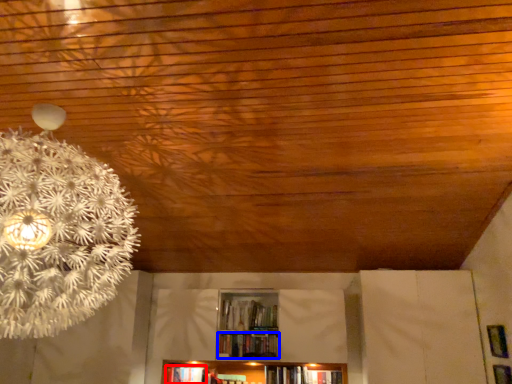
Question: Which point is closer to the camera, book (highlighted by a red box) or book (highlighted by a blue box)?

Choices:
 (A) book
 (B) book

Answer: (B)